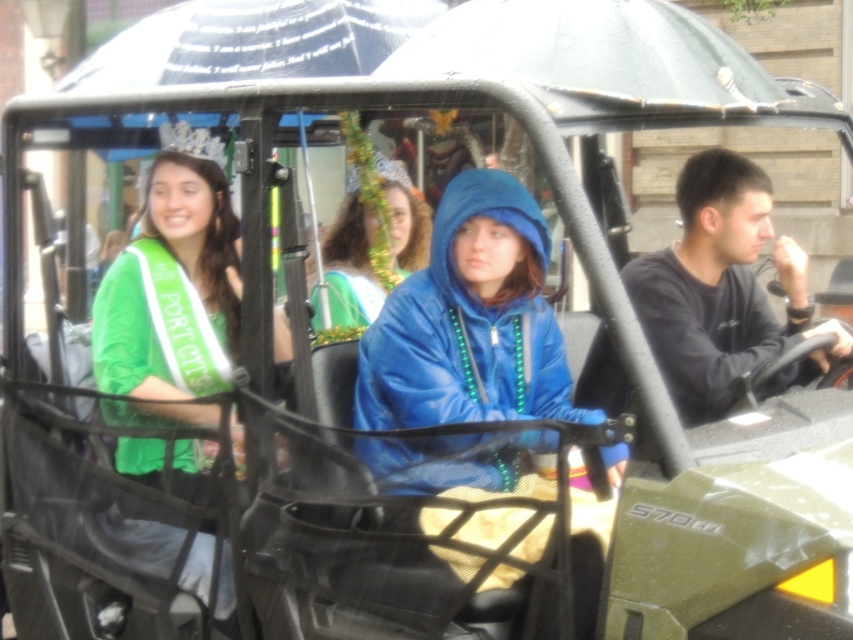
Does dark gray sweatshirt at right appear under blue matte jacket at center?

Yes, dark gray sweatshirt at right is below blue matte jacket at center.

Does dark gray sweatshirt at right have a lesser width compared to blue matte jacket at center?

In fact, dark gray sweatshirt at right might be wider than blue matte jacket at center.

Locate an element on the screen. dark gray sweatshirt at right is located at coordinates (723, 291).

In order to click on dark gray sweatshirt at right in this screenshot , I will do `click(723, 291)`.

Between point (177, 211) and point (786, 314), which one is positioned behind?

The point (786, 314) is more distant.

Is green satin sash at left positioned behind dark gray sweatshirt at right?

No, it is not.

This screenshot has height=640, width=853. Identify the location of green satin sash at left. (172, 289).

Is point (97, 323) positioned behind point (335, 292)?

No, (97, 323) is in front of (335, 292).

Who is shorter, green satin sash at left or blue matte jacket at center?

With less height is blue matte jacket at center.

Who is more forward, (x=126, y=472) or (x=360, y=316)?

Point (x=126, y=472) is more forward.

Find the location of a particular element. Image resolution: width=853 pixels, height=640 pixels. green satin sash at left is located at coordinates (172, 289).